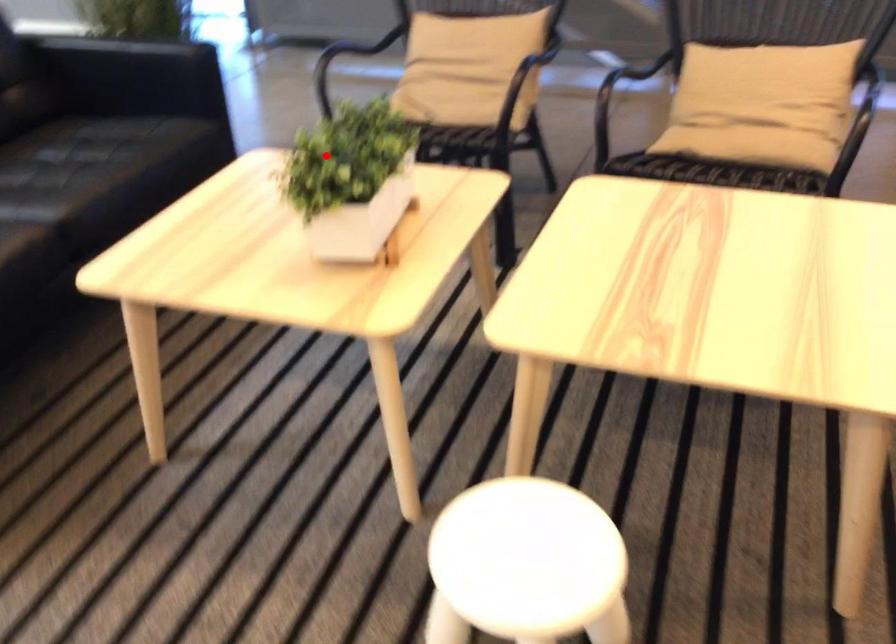
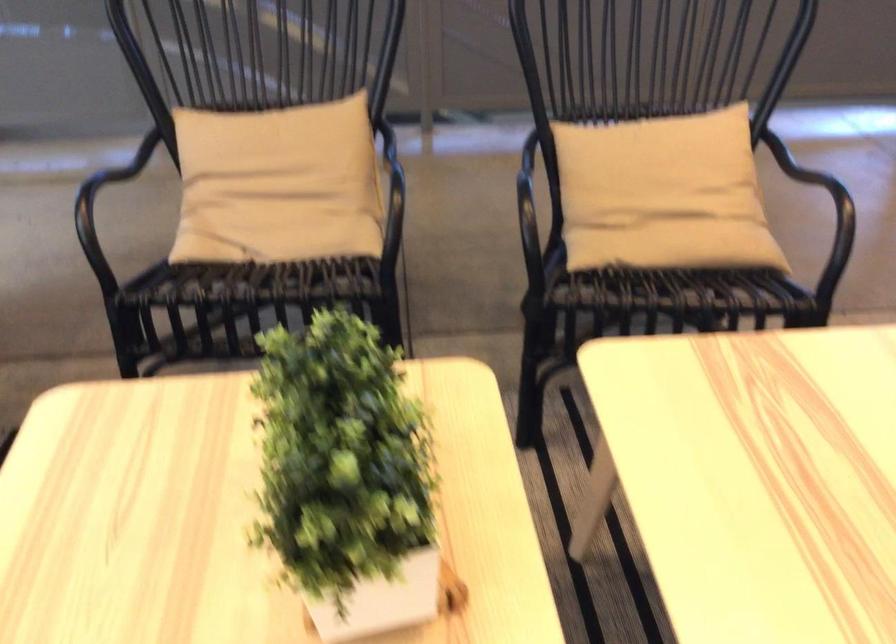
Question: I am providing you with two images of the same scene from different viewpoints. In image1, a red point is highlighted. Considering the same 3D point in image2, which of the following is correct?

Choices:
 (A) It is closer
 (B) It is farther

Answer: (A)